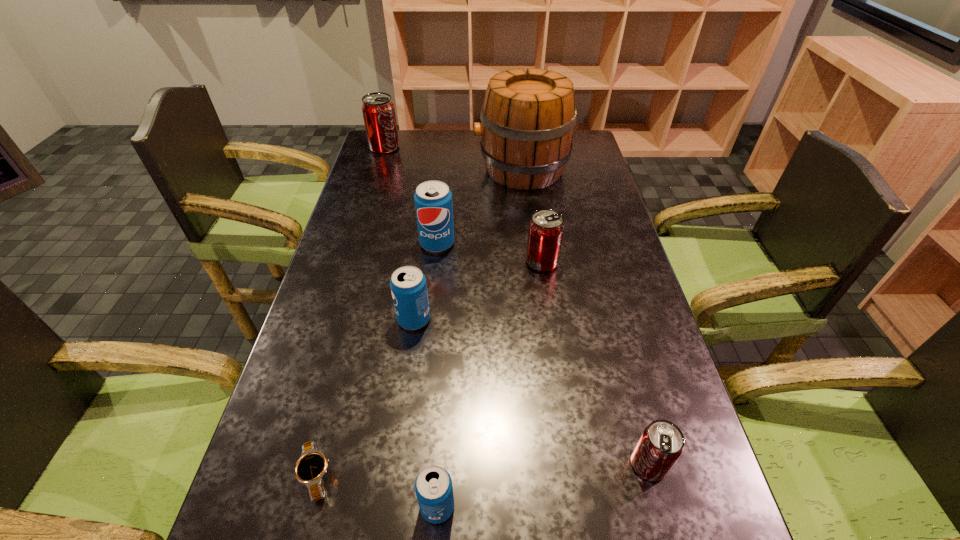
The width and height of the screenshot is (960, 540). Identify the location of the nearest blue soda can. (433, 486).

The image size is (960, 540). What are the coordinates of `the nearest soda can` in the screenshot? It's located at (433, 486).

Where is `black watch`? Image resolution: width=960 pixels, height=540 pixels. black watch is located at coordinates (310, 468).

Where is `the shortest object`? The image size is (960, 540). the shortest object is located at coordinates click(310, 468).

The image size is (960, 540). What are the coordinates of `free region located on the side of the tallest object where the spigot is located` in the screenshot? It's located at (461, 170).

The image size is (960, 540). I want to click on free space located on the side of the tallest object where the spigot is located, so click(433, 170).

This screenshot has width=960, height=540. What are the coordinates of `vacant space situated on the side of the tallest object where the spigot is located` in the screenshot? It's located at (453, 170).

You are a GUI agent. You are given a task and a screenshot of the screen. Output one action in this format:
    pyautogui.click(x=<x>, y=<y>)
    Task: Click on the free space located 0.070m on the right of the leftmost soda can
    This screenshot has width=960, height=540.
    Given the screenshot: What is the action you would take?
    pyautogui.click(x=418, y=147)

Locate an element on the screen. free location located on the back of the biggest blue soda can is located at coordinates (443, 197).

The height and width of the screenshot is (540, 960). In order to click on free region located 0.400m on the right of the fifth farthest object in this screenshot , I will do `click(591, 320)`.